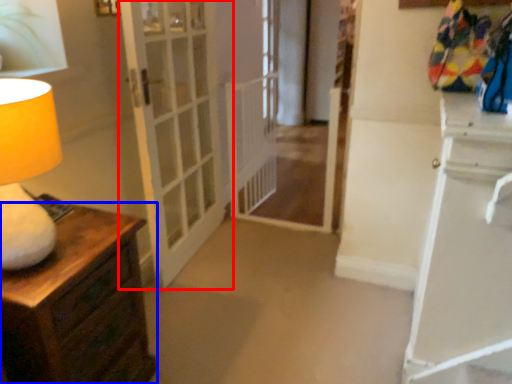
Question: Which point is closer to the camera, door (highlighted by a red box) or chest of drawers (highlighted by a blue box)?

Choices:
 (A) door
 (B) chest of drawers

Answer: (B)